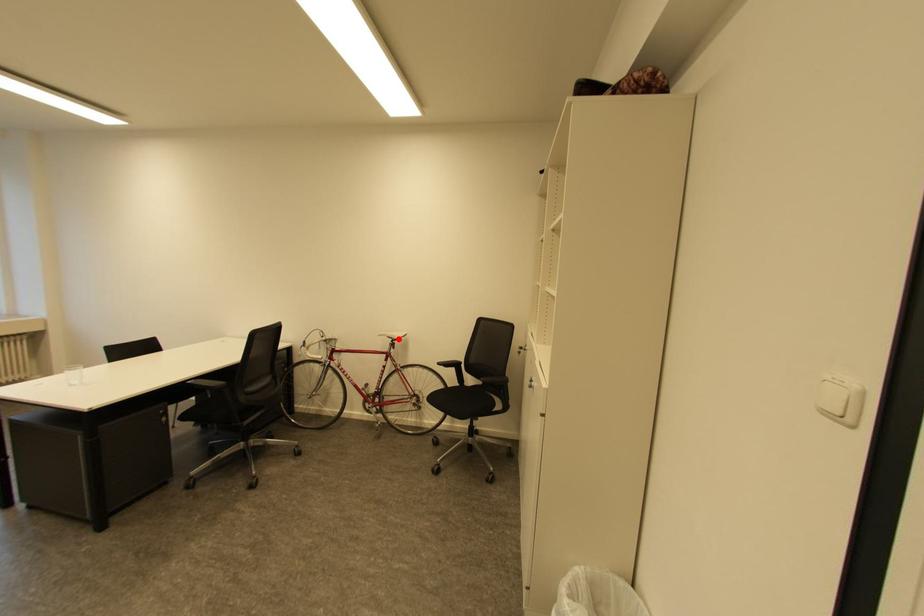
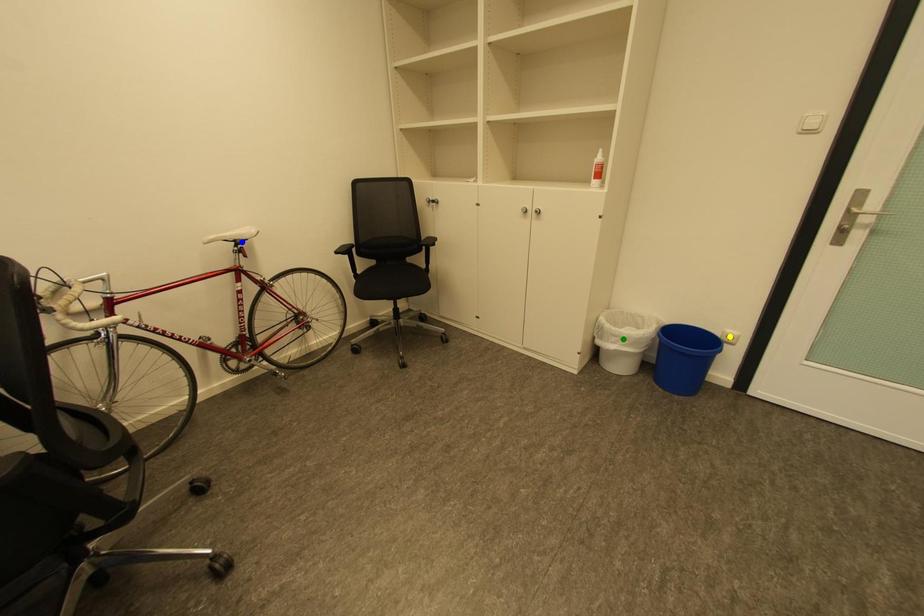
Question: I am providing you with two images of the same scene from different viewpoints. A red point is marked on the first image. You are given multiple points on the second image. Can you choose the point in image 2 that corresponds to the point in image 1?

Choices:
 (A) yellow point
 (B) blue point
 (C) green point

Answer: (B)